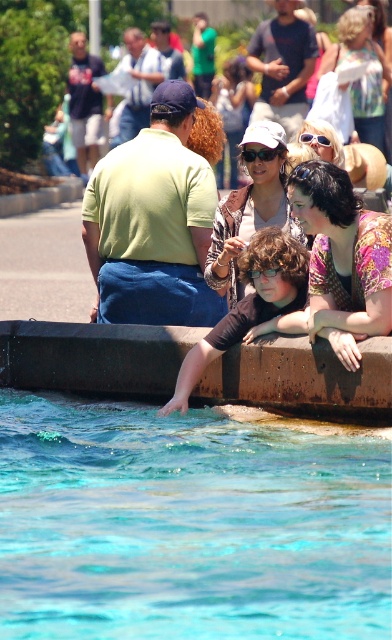
Does green matte shirt at upper left have a greater width compared to matte white sunglasses at upper center?

Indeed, green matte shirt at upper left has a greater width compared to matte white sunglasses at upper center.

Can you confirm if green matte shirt at upper left is smaller than matte white sunglasses at upper center?

Correct, green matte shirt at upper left occupies less space than matte white sunglasses at upper center.

The image size is (392, 640). I want to click on green matte shirt at upper left, so click(x=152, y=221).

Is matte brown jacket at center to the right of dark blue t-shirt at upper left from the viewer's perspective?

Yes, matte brown jacket at center is to the right of dark blue t-shirt at upper left.

Between point (221, 227) and point (83, 52), which one is positioned in front?

Point (221, 227)

Where is `matte brown jacket at center`? The image size is (392, 640). matte brown jacket at center is located at coordinates (250, 211).

Does floral print shirt at center have a lesser width compared to matte white sunglasses at upper center?

Yes.

Which of these two, floral print shirt at center or matte white sunglasses at upper center, stands shorter?

floral print shirt at center

Is point (386, 236) less distant than point (359, 124)?

Yes, point (386, 236) is in front of point (359, 124).

The height and width of the screenshot is (640, 392). I want to click on floral print shirt at center, so click(x=343, y=257).